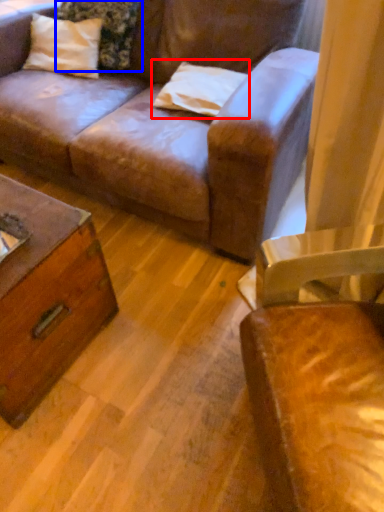
Question: Which of the following is the closest to the observer, pillow (highlighted by a red box) or pillow (highlighted by a blue box)?

Choices:
 (A) pillow
 (B) pillow

Answer: (A)